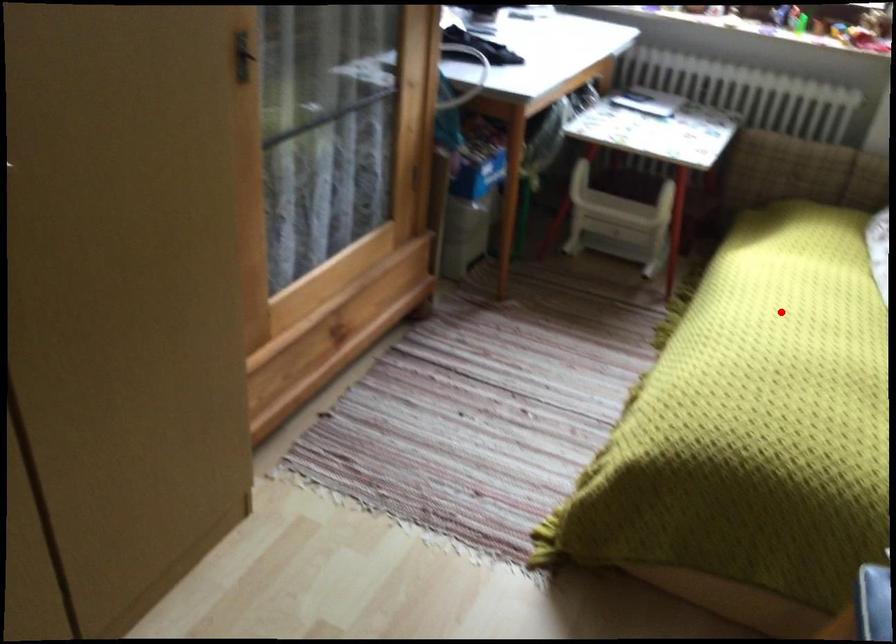
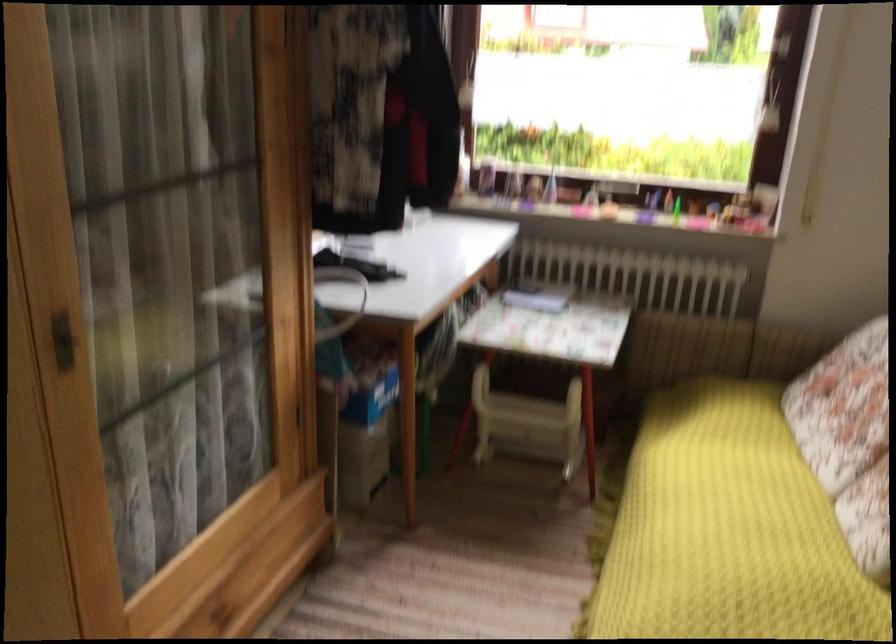
Question: I am providing you with two images of the same scene from different viewpoints. Image1 has a red point marked. In image2, the corresponding 3D location appears at what relative position? Reply with the corresponding letter.

Choices:
 (A) Closer
 (B) Farther

Answer: (A)